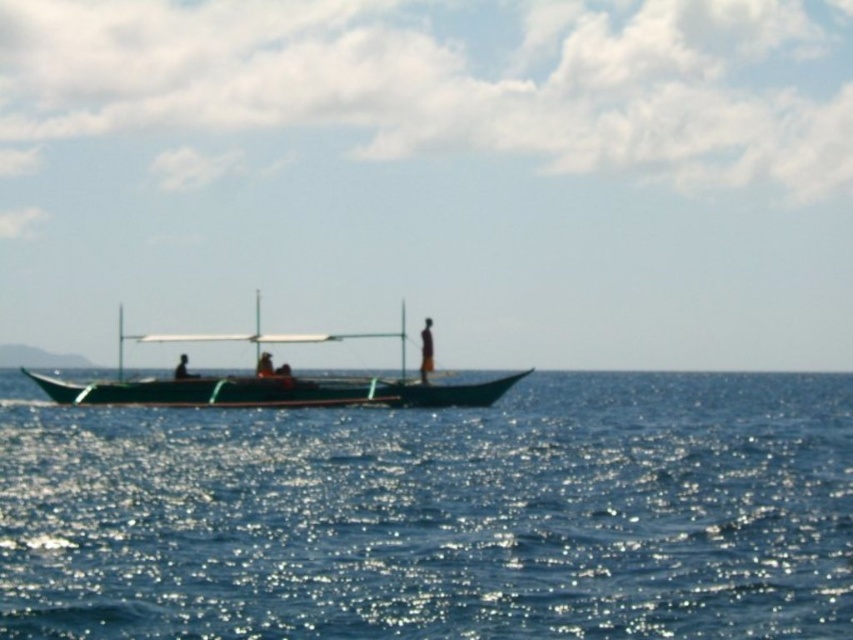
Is blue water at center closer to camera compared to orange fabric person at center?

Yes, blue water at center is closer to the viewer.

Is blue water at center wider than orange fabric person at center?

Yes, blue water at center is wider than orange fabric person at center.

At what (x,y) coordinates should I click in order to perform the action: click on blue water at center. Please return your answer as a coordinate pair (x, y). The width and height of the screenshot is (853, 640). Looking at the image, I should click on (437, 515).

This screenshot has height=640, width=853. I want to click on blue water at center, so click(437, 515).

Which of these two, dark brown wooden boat at center or dark brown wooden person at center, stands shorter?

With less height is dark brown wooden boat at center.

In order to click on dark brown wooden boat at center in this screenshot , I will do click(264, 365).

Between point (257, 365) and point (189, 376), which one is positioned in front?

Point (189, 376) is in front.

Locate an element on the screen. The width and height of the screenshot is (853, 640). dark brown wooden boat at center is located at coordinates (264, 365).

Can you confirm if orange fabric person at center is taller than dark brown wooden person at center?

Indeed, orange fabric person at center has a greater height compared to dark brown wooden person at center.

Does orange fabric person at center have a greater width compared to dark brown wooden person at center?

No, orange fabric person at center is not wider than dark brown wooden person at center.

This screenshot has height=640, width=853. Find the location of `orange fabric person at center`. orange fabric person at center is located at coordinates (426, 349).